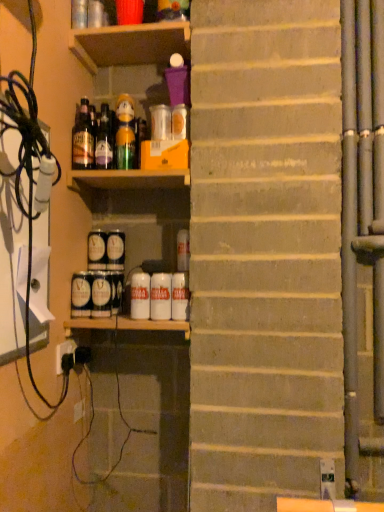
Question: Is blue matte can at lower center, which is the sixth beverage in right-to-left order, inside or outside of white matte can at center, which ranks as the 5th beverage in left-to-right order?

Choices:
 (A) outside
 (B) inside

Answer: (A)

Question: Considering the positions of point (107, 287) and point (140, 274), is point (107, 287) closer or farther from the camera than point (140, 274)?

Choices:
 (A) farther
 (B) closer

Answer: (A)

Question: Considering the real-world distances, which object is farthest from the white matte can at center, which is the 1th beverage in right-to-left order?

Choices:
 (A) blue matte can at lower center, which is counted as the third beverage, starting from the left
 (B) white matte can at center, which ranks as the 5th beverage in left-to-right order
 (C) matte black can at center, which ranks as the 8th beverage in right-to-left order
 (D) matte black can at center, the 4th beverage positioned from the left
 (E) matte black can at center left, the 7th beverage from the right

Answer: (E)

Question: Which is farther from the wooden shelf at upper center?

Choices:
 (A) white matte can at center, which appears as the 7th beverage when viewed from the left
 (B) green glass bottle at upper center, the 1th bottle when ordered from right to left
 (C) matte black can at center, the first beverage in the left-to-right sequence
 (D) matte black can at center, the 4th beverage positioned from the left
 (E) matte glass bottle at upper left, which is the first bottle from left to right

Answer: (C)